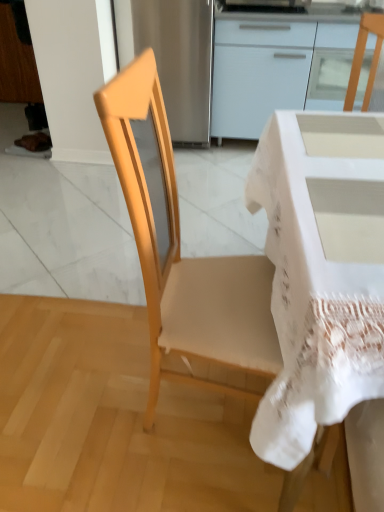
Question: Is the depth of white glossy cabinet at upper center less than that of white lace-covered desk at center?

Choices:
 (A) yes
 (B) no

Answer: (B)

Question: From a real-world perspective, is white glossy cabinet at upper center positioned under white lace-covered desk at center based on gravity?

Choices:
 (A) no
 (B) yes

Answer: (A)

Question: Considering the relative sizes of white glossy cabinet at upper center and white lace-covered desk at center in the image provided, is white glossy cabinet at upper center bigger than white lace-covered desk at center?

Choices:
 (A) yes
 (B) no

Answer: (A)

Question: From the image's perspective, would you say white glossy cabinet at upper center is shown under white lace-covered desk at center?

Choices:
 (A) no
 (B) yes

Answer: (A)

Question: Does white glossy cabinet at upper center touch white lace-covered desk at center?

Choices:
 (A) no
 (B) yes

Answer: (A)

Question: Would you say white glossy cabinet at upper center contains white lace-covered desk at center?

Choices:
 (A) yes
 (B) no

Answer: (B)

Question: Can you confirm if white glossy cabinet at upper center is bigger than light wood chair at center?

Choices:
 (A) yes
 (B) no

Answer: (A)

Question: Could you tell me if white glossy cabinet at upper center is facing light wood chair at center?

Choices:
 (A) yes
 (B) no

Answer: (A)

Question: Considering the relative sizes of white glossy cabinet at upper center and light wood chair at center in the image provided, is white glossy cabinet at upper center smaller than light wood chair at center?

Choices:
 (A) yes
 (B) no

Answer: (B)

Question: Is white glossy cabinet at upper center at the right side of light wood chair at center?

Choices:
 (A) yes
 (B) no

Answer: (A)

Question: From the image's perspective, does white glossy cabinet at upper center appear lower than light wood chair at center?

Choices:
 (A) no
 (B) yes

Answer: (A)

Question: Is white glossy cabinet at upper center looking in the opposite direction of light wood chair at center?

Choices:
 (A) yes
 (B) no

Answer: (B)

Question: Is the position of white lace-covered desk at center more distant than that of white glossy cabinet at upper center?

Choices:
 (A) no
 (B) yes

Answer: (A)